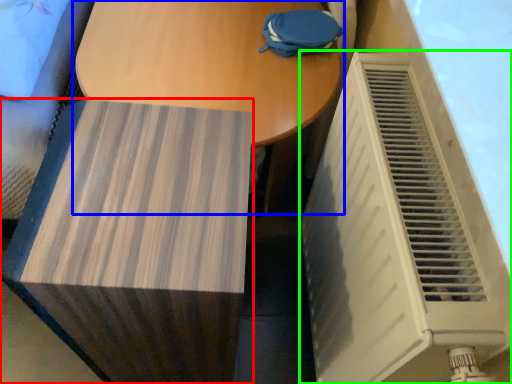
Question: Which object is the closest to the furniture (highlighted by a red box)? Choose among these: table (highlighted by a blue box) or air conditioning (highlighted by a green box).

Choices:
 (A) table
 (B) air conditioning

Answer: (B)